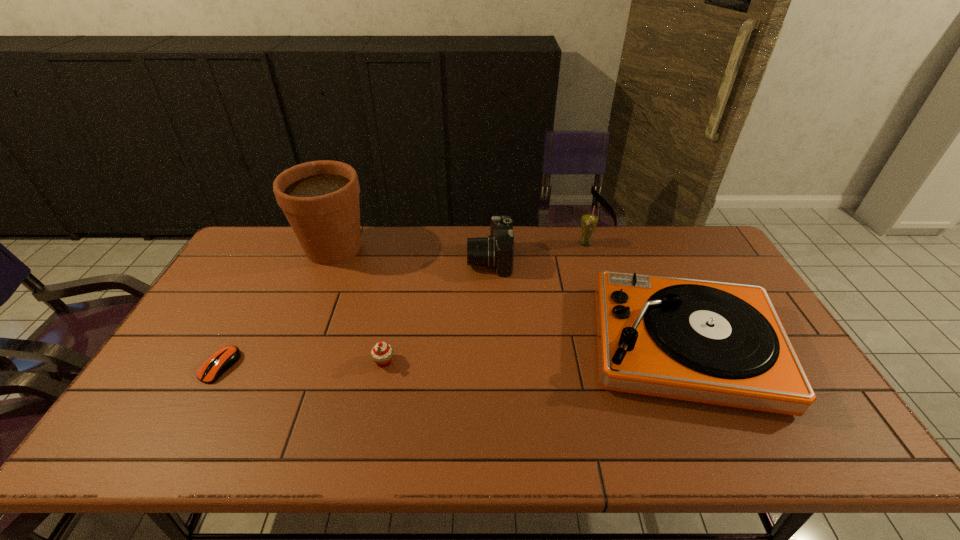
This screenshot has height=540, width=960. I want to click on free spot located 0.160m on the right of the fifth shortest object, so click(x=638, y=244).

Where is `free spot located 0.170m on the lens of the camera`? free spot located 0.170m on the lens of the camera is located at coordinates (418, 259).

Find the location of a particular element. free space located 0.110m on the lens of the camera is located at coordinates [436, 259].

Where is `vacant space located 0.330m on the lens of the camera`? vacant space located 0.330m on the lens of the camera is located at coordinates click(372, 259).

Locate an element on the screen. vacant point located 0.210m on the left of the record player is located at coordinates tap(512, 345).

The height and width of the screenshot is (540, 960). Find the location of `free space located on the left of the second shortest object`. free space located on the left of the second shortest object is located at coordinates pos(309,361).

Identify the location of free spot located on the back of the shortest object. This screenshot has width=960, height=540. coord(254,303).

Locate an element on the screen. The image size is (960, 540). flowerpot present at the far edge is located at coordinates (320, 199).

Where is `straw for drinking located in the far edge section of the desktop`? straw for drinking located in the far edge section of the desktop is located at coordinates (589, 221).

I want to click on camera that is positioned at the far edge, so click(x=496, y=251).